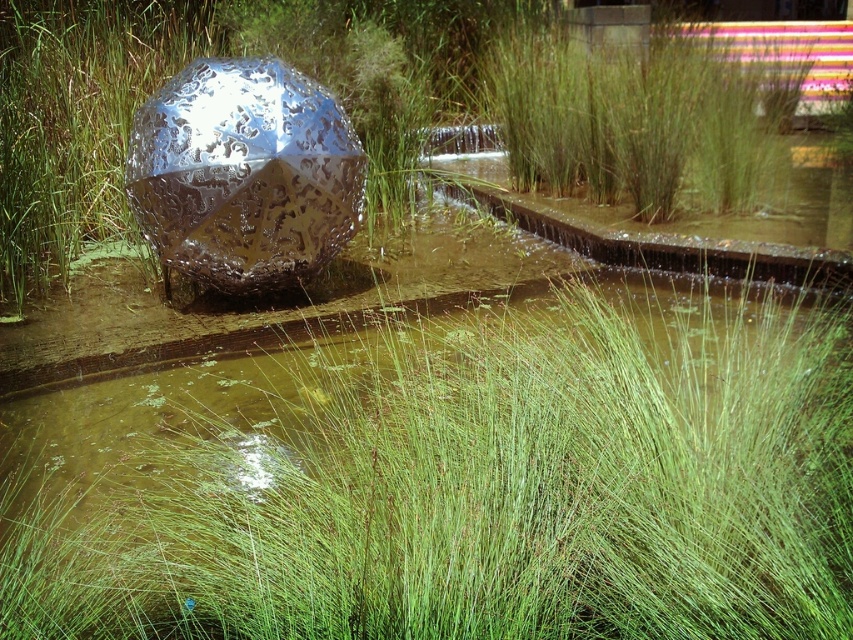
Question: Is green grass at center wider than metallic silver disco ball at center?

Choices:
 (A) yes
 (B) no

Answer: (A)

Question: Is green grass at center wider than metallic silver disco ball at center?

Choices:
 (A) yes
 (B) no

Answer: (A)

Question: Which point is farther to the camera?

Choices:
 (A) click(x=752, y=176)
 (B) click(x=280, y=65)

Answer: (A)

Question: Which point appears farthest from the camera in this image?

Choices:
 (A) coord(844,548)
 (B) coord(518,54)
 (C) coord(202,132)

Answer: (B)

Question: Which point appears closest to the camera in this image?

Choices:
 (A) 170,193
 (B) 548,392

Answer: (B)

Question: Is green grass at center below green grass at upper center?

Choices:
 (A) no
 (B) yes

Answer: (B)